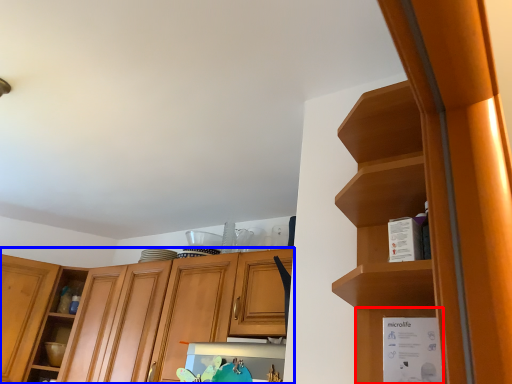
Question: Among these objects, which one is nearest to the camera, cabinet (highlighted by a red box) or cabinetry (highlighted by a blue box)?

Choices:
 (A) cabinet
 (B) cabinetry

Answer: (A)